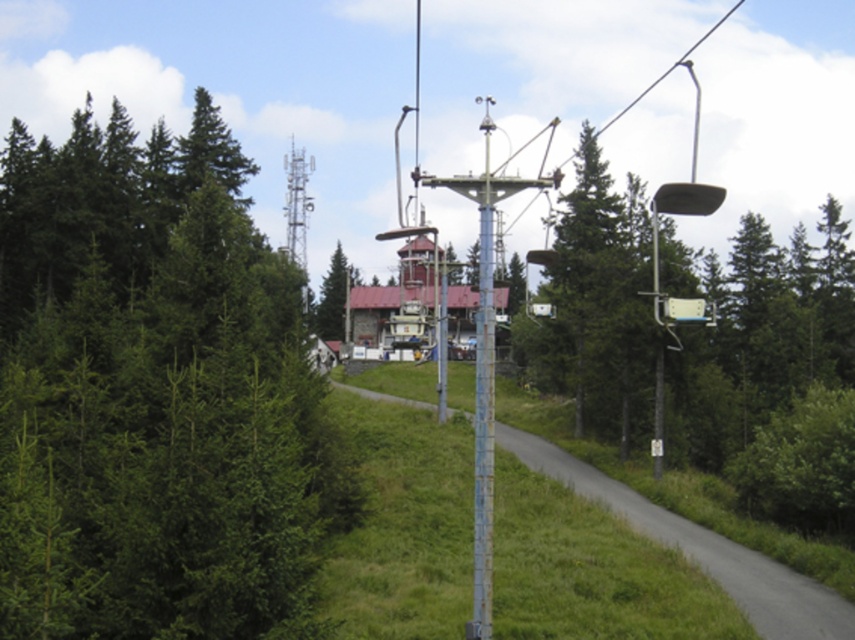
Question: Is green matte tree at left positioned at the back of green textured tree at center?

Choices:
 (A) yes
 (B) no

Answer: (B)

Question: Is green matte tree at left positioned at the back of rusty metal pole at center?

Choices:
 (A) no
 (B) yes

Answer: (A)

Question: Based on their relative distances, which object is farther from the green textured tree at center?

Choices:
 (A) rusty metal pole at center
 (B) green matte tree at left

Answer: (B)

Question: Among these objects, which one is farthest from the camera?

Choices:
 (A) green matte tree at left
 (B) rusty metal pole at center

Answer: (B)

Question: Among these points, which one is farthest from the camera?

Choices:
 (A) (323, 337)
 (B) (87, 253)

Answer: (A)

Question: Is green matte tree at left below rusty metal pole at center?

Choices:
 (A) yes
 (B) no

Answer: (A)